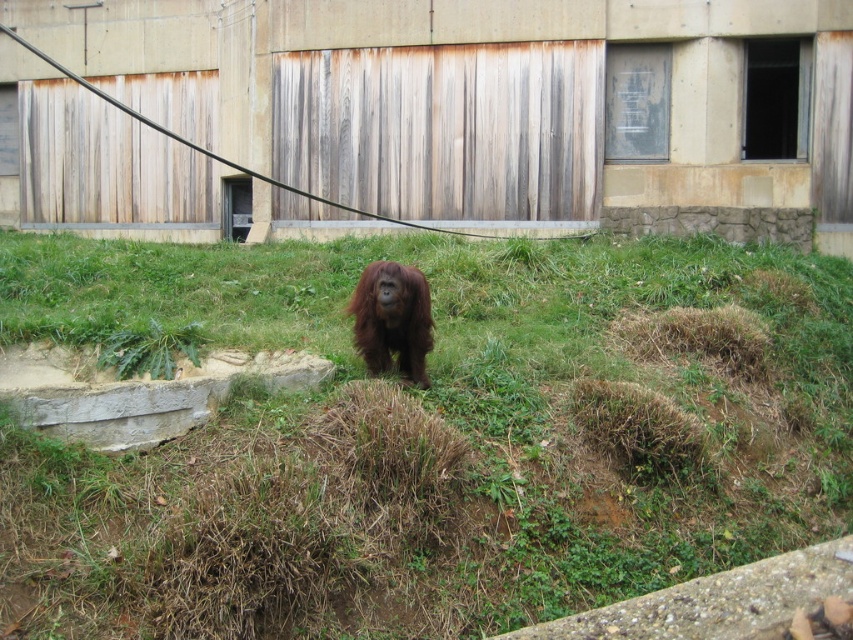
Is point (91, 308) in front of point (367, 266)?

Yes, point (91, 308) is closer to viewer.

Who is more distant from viewer, [724,282] or [386,298]?

The point [724,282] is more distant.

In order to click on green grassy at center in this screenshot , I will do `click(445, 420)`.